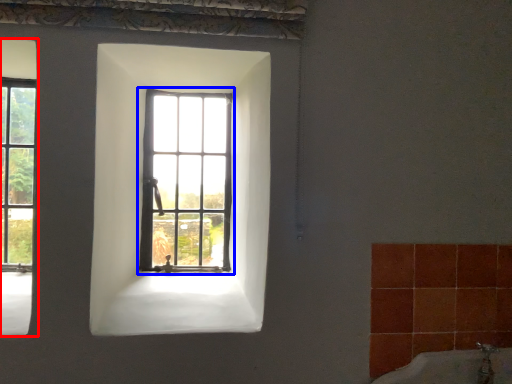
Question: Which of the following is the farthest to the observer, window (highlighted by a red box) or window (highlighted by a blue box)?

Choices:
 (A) window
 (B) window

Answer: (B)